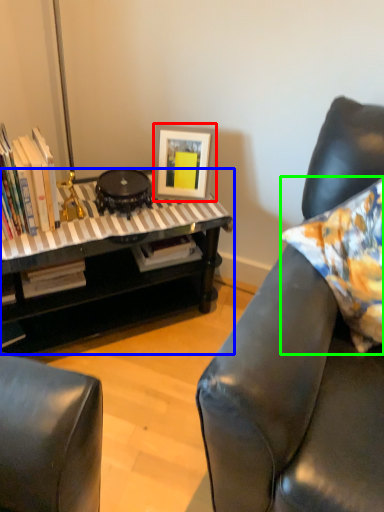
Question: Estimate the real-world distances between objects in this image. Which object is farther from picture frame (highlighted by a red box), table (highlighted by a blue box) or pillow (highlighted by a green box)?

Choices:
 (A) table
 (B) pillow

Answer: (B)